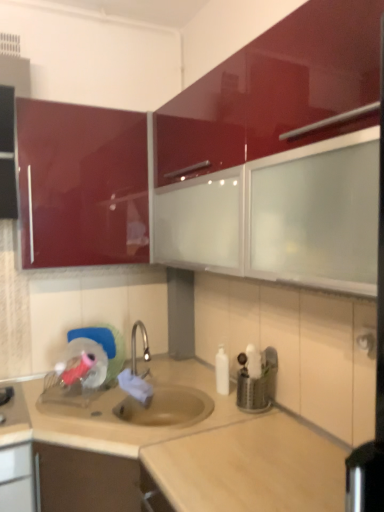
You are a GUI agent. You are given a task and a screenshot of the screen. Output one action in this format:
    pyautogui.click(x=<x>, y=<y>)
    Task: Click on the free region under glossy red cabinet at upper center, the first cabinetry positioned from the right (from a real-world perspective)
    Image resolution: width=384 pixels, height=512 pixels.
    Given the screenshot: What is the action you would take?
    pyautogui.click(x=251, y=426)